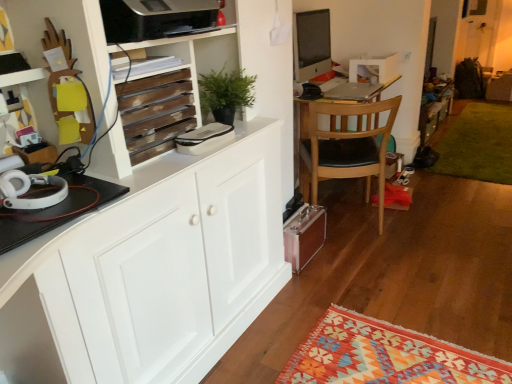
Locate an element on the screen. Image resolution: width=512 pixels, height=384 pixels. vacant area that is in front of light brown wood chair at center is located at coordinates (379, 256).